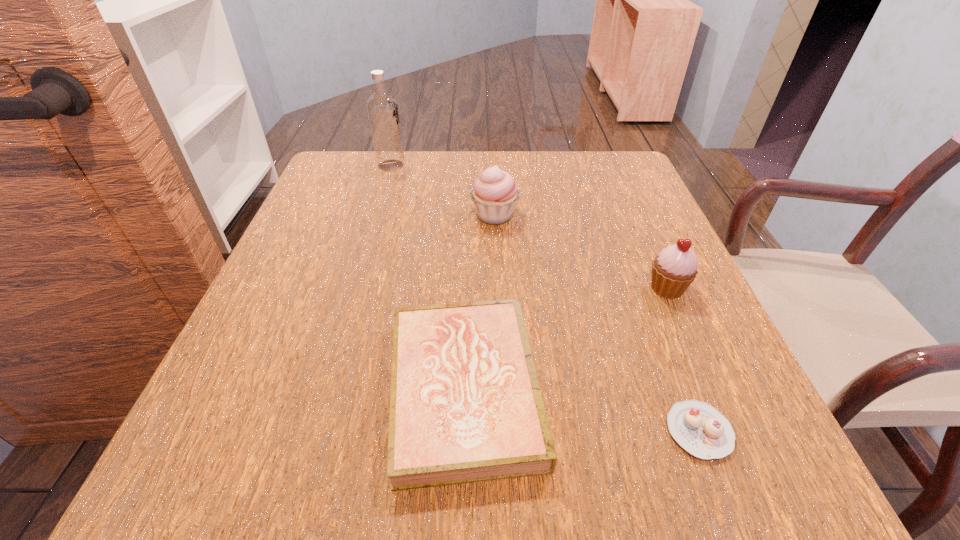
Locate an element on the screen. The height and width of the screenshot is (540, 960). free location at the far edge is located at coordinates (499, 159).

Where is `vacant area at the left edge`? The height and width of the screenshot is (540, 960). vacant area at the left edge is located at coordinates (304, 253).

Image resolution: width=960 pixels, height=540 pixels. I want to click on vacant area at the right edge, so click(652, 384).

In the image, there is a desktop. What are the coordinates of `free space at the far left corner` in the screenshot? It's located at (379, 172).

Identify the location of free space at the near left corner of the desktop. (249, 441).

At what (x,y) coordinates should I click in order to perform the action: click on free spot at the far right corner of the desktop. Please return your answer as a coordinate pair (x, y). This screenshot has height=540, width=960. Looking at the image, I should click on (621, 160).

At what (x,y) coordinates should I click in order to perform the action: click on empty location between the farthest cupcake and the third nearest object. Please return your answer as a coordinate pair (x, y). This screenshot has width=960, height=540. Looking at the image, I should click on (581, 252).

This screenshot has height=540, width=960. I want to click on unoccupied position between the hardback book and the third nearest object, so click(565, 339).

The height and width of the screenshot is (540, 960). I want to click on free space that is in between the farthest object and the second nearest cupcake, so click(x=529, y=227).

Locate an element on the screen. The width and height of the screenshot is (960, 540). vacant space that's between the farthest cupcake and the nearest cupcake is located at coordinates (596, 323).